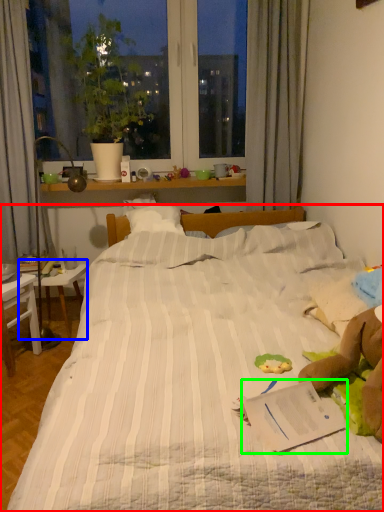
Question: Which object is the closest to the bed (highlighted by a red box)? Choose among these: table (highlighted by a blue box) or paperback book (highlighted by a green box).

Choices:
 (A) table
 (B) paperback book

Answer: (B)